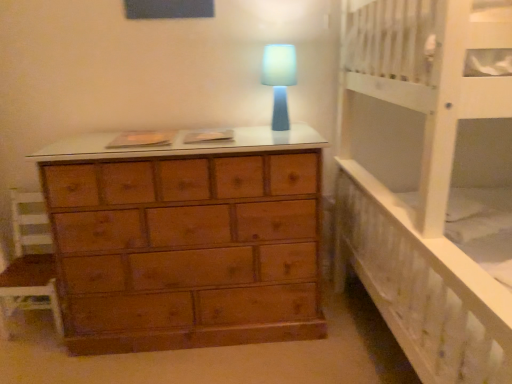
I want to click on wooden chair at left, so click(x=29, y=266).

What are the coordinates of `white wooden bed at right` in the screenshot? It's located at (x=430, y=178).

The image size is (512, 384). What are the coordinates of `blue matte lamp at center` in the screenshot? It's located at (279, 80).

Can you tell me how much blue matte lamp at center and wooden chair at left differ in facing direction?

blue matte lamp at center and wooden chair at left are facing 1.14 degrees away from each other.

Is blue matte lamp at center outside of wooden chair at left?

blue matte lamp at center is positioned outside wooden chair at left.

Based on the photo, considering the sizes of objects blue matte lamp at center and wooden chair at left in the image provided, who is thinner, blue matte lamp at center or wooden chair at left?

blue matte lamp at center.

Is blue matte lamp at center at the back of wooden chair at left?

That's not correct — wooden chair at left is not looking away from blue matte lamp at center.

From the image's perspective, is wooden chair at left below blue matte lamp at center?

Yes, from the image's perspective, wooden chair at left is below blue matte lamp at center.

Is wooden chair at left closer to the viewer compared to blue matte lamp at center?

No, wooden chair at left is further to the viewer.

What's the angular difference between wooden chair at left and blue matte lamp at center's facing directions?

There is a 1.14-degree angle between the facing directions of wooden chair at left and blue matte lamp at center.

Consider the image. Could you tell me if white wooden bed at right is turned towards wooden chair at left?

Yes.

From the image's perspective, does white wooden bed at right appear lower than wooden chair at left?

No, from the image's perspective, white wooden bed at right is not below wooden chair at left.

Which object is closer to the camera taking this photo, white wooden bed at right or wooden chair at left?

white wooden bed at right is more forward.

Considering the sizes of objects white wooden bed at right and wooden chair at left in the image provided, who is taller, white wooden bed at right or wooden chair at left?

white wooden bed at right.

Does point (269, 63) come farther from viewer compared to point (384, 98)?

Yes, point (269, 63) is behind point (384, 98).

Based on the photo, would you say blue matte lamp at center is a long distance from white wooden bed at right?

No, blue matte lamp at center is in close proximity to white wooden bed at right.

Could you tell me if blue matte lamp at center is facing white wooden bed at right?

No, blue matte lamp at center is not facing towards white wooden bed at right.

Considering the relative sizes of blue matte lamp at center and white wooden bed at right in the image provided, is blue matte lamp at center taller than white wooden bed at right?

No, blue matte lamp at center is not taller than white wooden bed at right.

Where is `lamp above the white wooden bed at right (from the image's perspective)`? This screenshot has height=384, width=512. lamp above the white wooden bed at right (from the image's perspective) is located at coordinates (279, 80).

In the image, is white wooden bed at right positioned in front of or behind blue matte lamp at center?

white wooden bed at right is in front of blue matte lamp at center.

Are white wooden bed at right and blue matte lamp at center located far from each other?

No, there isn't a large distance between white wooden bed at right and blue matte lamp at center.

Which is more distant, (18, 213) or (417, 82)?

The point (18, 213) is farther.

Can you tell me how much wooden chair at left and white wooden bed at right differ in facing direction?

The angle between the facing direction of wooden chair at left and the facing direction of white wooden bed at right is 88.9 degrees.

In the image, is wooden chair at left positioned in front of or behind white wooden bed at right?

Visually, wooden chair at left is located behind white wooden bed at right.

Is wooden chair at left not inside white wooden bed at right?

Absolutely, wooden chair at left is external to white wooden bed at right.

At what (x,y) coordinates should I click in order to perform the action: click on chair on the left of blue matte lamp at center. Please return your answer as a coordinate pair (x, y). This screenshot has width=512, height=384. Looking at the image, I should click on (29, 266).

Locate an element on the screen. This screenshot has height=384, width=512. lamp that is above the wooden chair at left (from a real-world perspective) is located at coordinates (279, 80).

Looking at this image, based on their spatial positions, is blue matte lamp at center or white wooden bed at right further from wooden chair at left?

The object further to wooden chair at left is white wooden bed at right.

When comparing their distances from blue matte lamp at center, does wooden chair at left or white wooden bed at right seem further?

wooden chair at left is further to blue matte lamp at center.

Considering their positions, is blue matte lamp at center positioned closer to white wooden bed at right than wooden chair at left?

blue matte lamp at center is closer to white wooden bed at right.

Based on their spatial positions, is wooden chair at left or blue matte lamp at center closer to white wooden bed at right?

Based on the image, blue matte lamp at center appears to be nearer to white wooden bed at right.

Estimate the real-world distances between objects in this image. Which object is closer to wooden chair at left, white wooden bed at right or blue matte lamp at center?

blue matte lamp at center is positioned closer to the anchor wooden chair at left.

Based on their spatial positions, is white wooden bed at right or wooden chair at left further from blue matte lamp at center?

Among the two, wooden chair at left is located further to blue matte lamp at center.

This screenshot has width=512, height=384. What are the coordinates of `lamp situated between wooden chair at left and white wooden bed at right from left to right` in the screenshot? It's located at (279, 80).